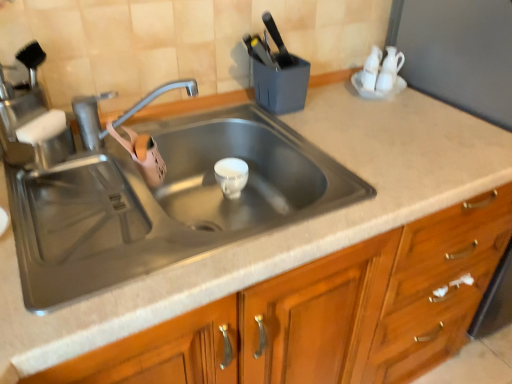
Question: Do you think satin nickel faucet at upper left is within wooden cabinet at center, or outside of it?

Choices:
 (A) inside
 (B) outside

Answer: (B)

Question: From a real-world perspective, is satin nickel faucet at upper left above or below wooden cabinet at center?

Choices:
 (A) below
 (B) above

Answer: (B)

Question: Based on their relative distances, which object is nearer to the wooden cabinet at center?

Choices:
 (A) satin nickel faucet at upper left
 (B) stainless steel sink at center

Answer: (B)

Question: Based on their relative distances, which object is farther from the satin nickel faucet at upper left?

Choices:
 (A) stainless steel sink at center
 (B) wooden cabinet at center

Answer: (B)